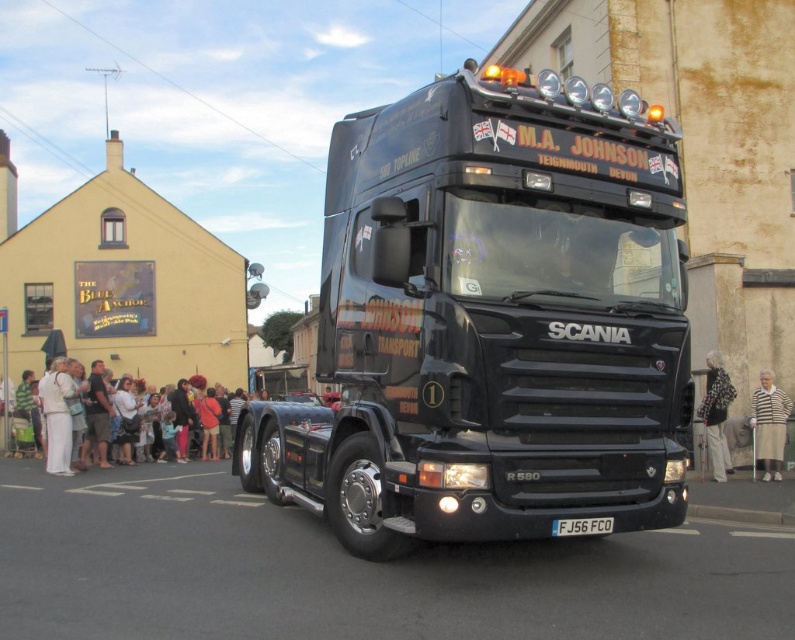
Does white cotton dress at lower left have a lesser width compared to black metal license plate at center?

Correct, white cotton dress at lower left's width is less than black metal license plate at center's.

Is point (107, 424) positioned in front of point (599, 524)?

No, (107, 424) is further to viewer.

This screenshot has height=640, width=795. In order to click on white cotton dress at lower left in this screenshot , I will do `click(74, 412)`.

Is black matte truck at center wider than black metal license plate at center?

Yes.

Looking at this image, is black matte truck at center shorter than black metal license plate at center?

Incorrect, black matte truck at center's height does not fall short of black metal license plate at center's.

Which is behind, point (417, 257) or point (599, 531)?

Positioned behind is point (417, 257).

Where is `black matte truck at center`? This screenshot has width=795, height=640. black matte truck at center is located at coordinates (491, 321).

Can you confirm if white fabric dress at left is taller than striped sweater at right?

Indeed, white fabric dress at left has a greater height compared to striped sweater at right.

Can you confirm if white fabric dress at left is wider than striped sweater at right?

Correct, the width of white fabric dress at left exceeds that of striped sweater at right.

Who is more forward, [66,371] or [770,376]?

Point [770,376] is more forward.

Identify the location of white fabric dress at left. The height and width of the screenshot is (640, 795). (57, 413).